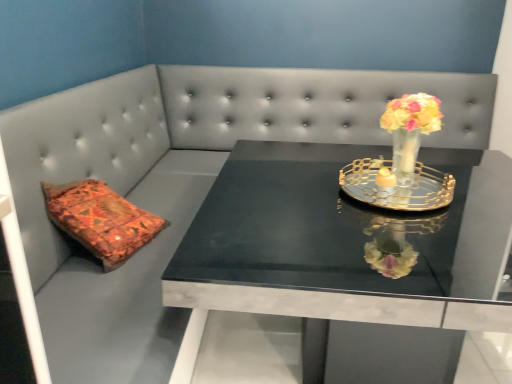
At what (x,y) coordinates should I click in order to perform the action: click on vacant area that lies in front of gold metallic tray at center. Please return your answer as a coordinate pair (x, y). This screenshot has width=512, height=384. Looking at the image, I should click on (385, 243).